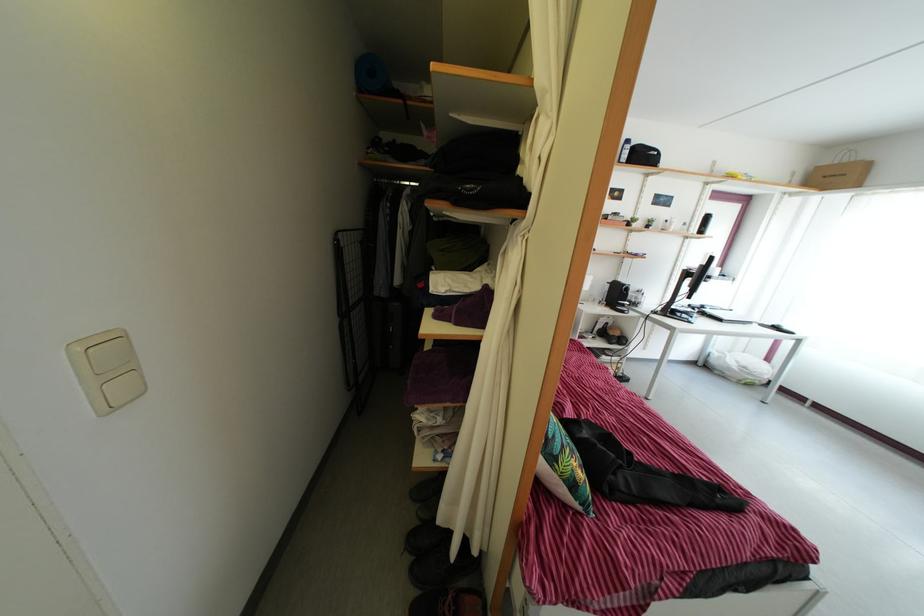
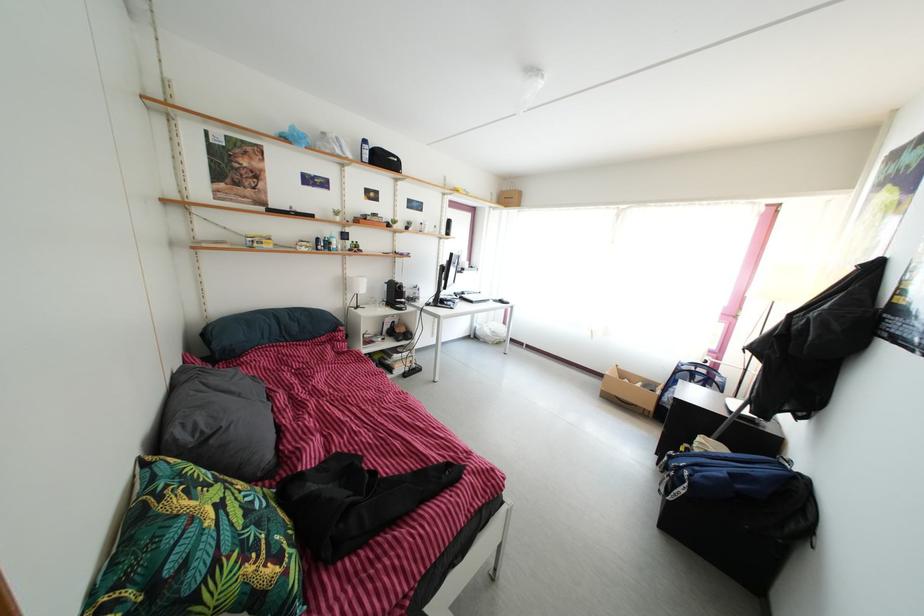
Question: Based on the continuous images, in which direction is the camera rotating? Reply with the corresponding letter.

Choices:
 (A) Left
 (B) Right
 (C) Up
 (D) Down

Answer: (B)